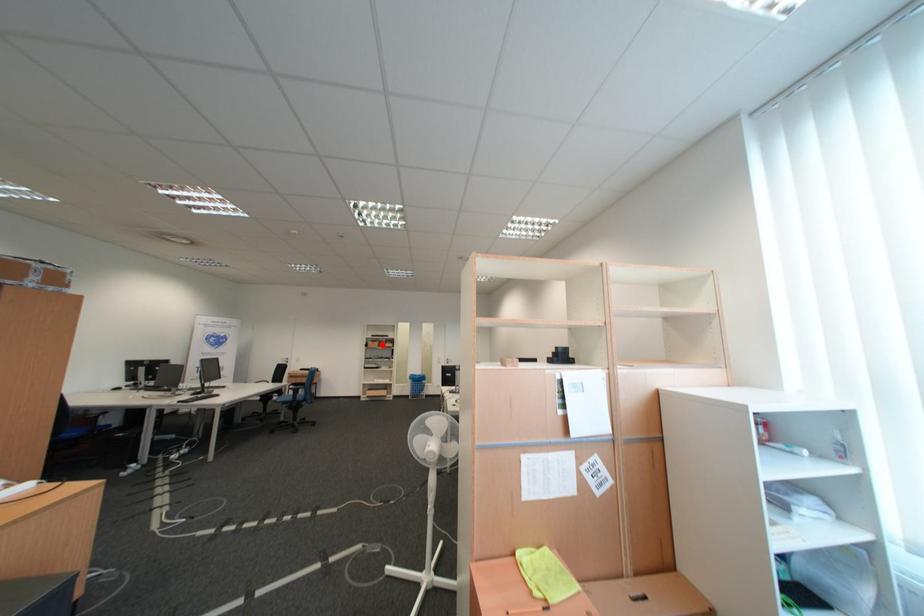
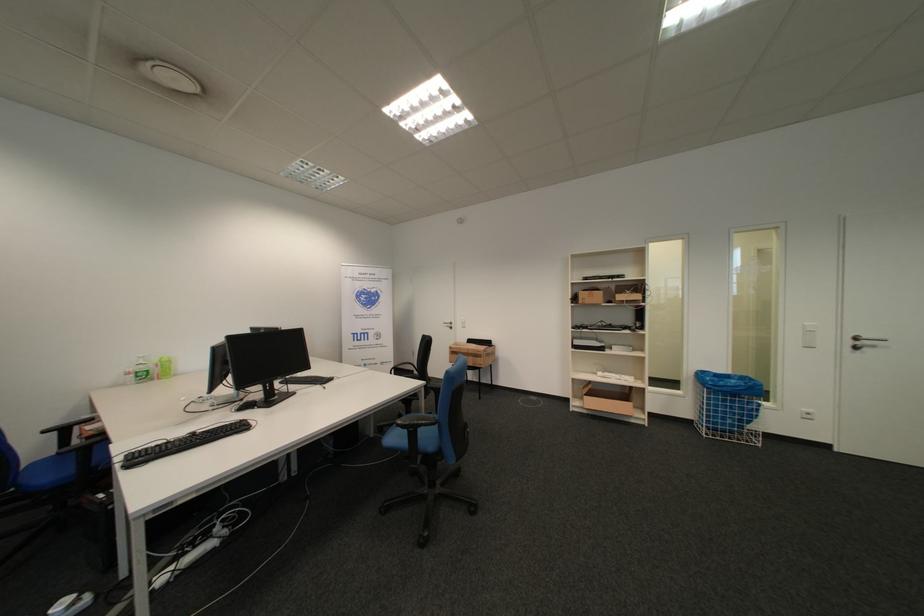
The point at the highlighted location is marked in the first image. Where is the corresponding point in the second image?

(594, 296)